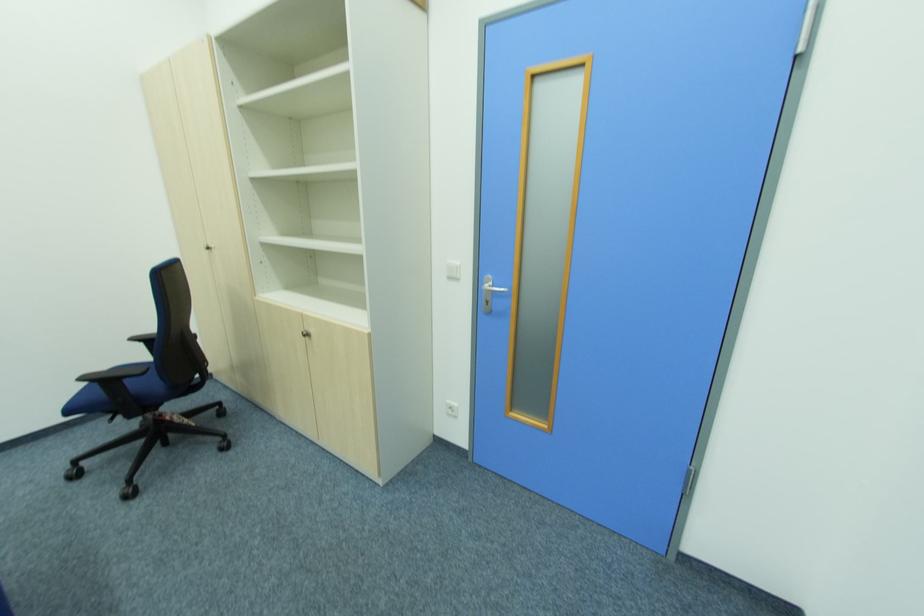
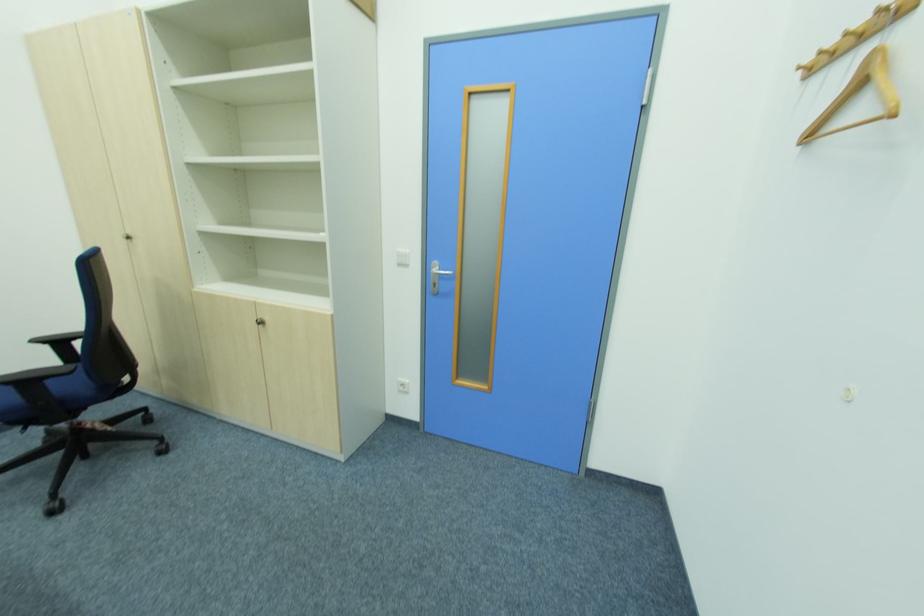
Find the pixel in the second image that matches [151,377] in the first image.

(75, 379)